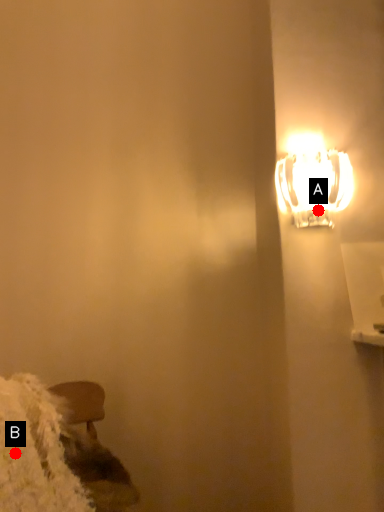
Question: Two points are circled on the image, labeled by A and B beside each circle. Which point is farther to the camera?

Choices:
 (A) A is further
 (B) B is further

Answer: (A)